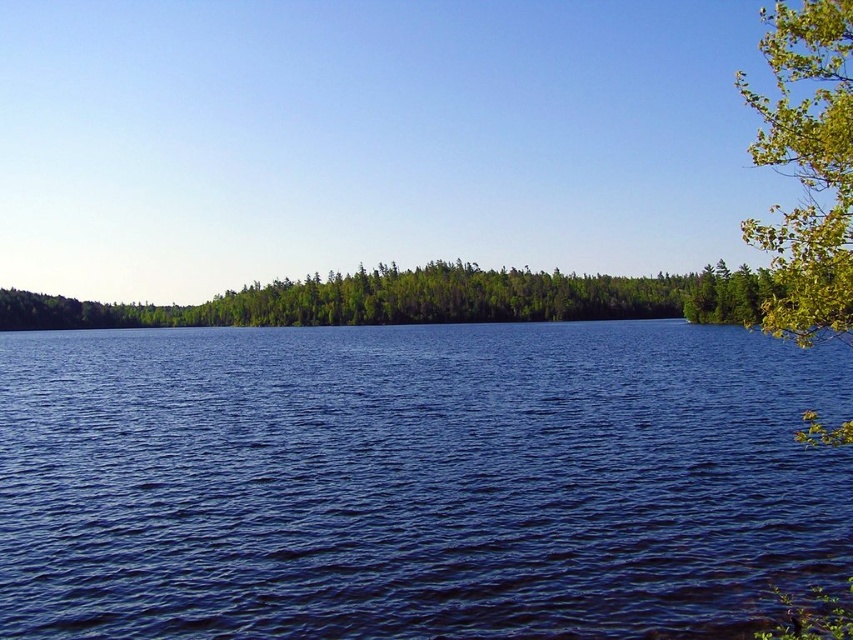
This screenshot has height=640, width=853. Find the location of `blue liquid water at center`. blue liquid water at center is located at coordinates (415, 481).

Does blue liquid water at center have a greater height compared to green matte forest at center?

In fact, blue liquid water at center may be shorter than green matte forest at center.

The height and width of the screenshot is (640, 853). In order to click on blue liquid water at center in this screenshot , I will do pos(415,481).

I want to click on blue liquid water at center, so click(415, 481).

Between blue liquid water at center and green leafy tree at right, which one appears on the left side from the viewer's perspective?

blue liquid water at center

At what (x,y) coordinates should I click in order to perform the action: click on blue liquid water at center. Please return your answer as a coordinate pair (x, y). This screenshot has height=640, width=853. Looking at the image, I should click on (415, 481).

In order to click on blue liquid water at center in this screenshot , I will do pos(415,481).

Between green matte forest at center and green leafy tree at right, which one has less height?

green matte forest at center

Does point (515, 292) lie behind point (825, 259)?

Yes, point (515, 292) is behind point (825, 259).

Which is behind, point (659, 292) or point (846, 433)?

The point (659, 292) is behind.

You are a GUI agent. You are given a task and a screenshot of the screen. Output one action in this format:
    pyautogui.click(x=<x>, y=<y>)
    Task: Click on the green matte forest at center
    
    Given the screenshot: What is the action you would take?
    pyautogui.click(x=422, y=300)